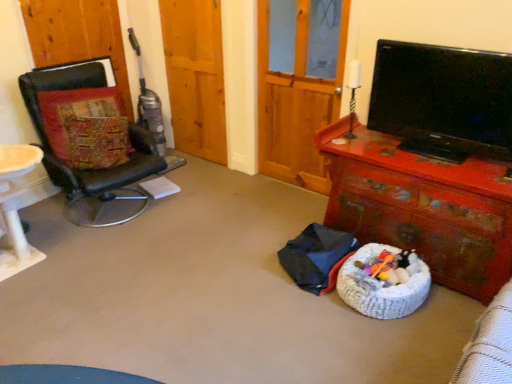
Image resolution: width=512 pixels, height=384 pixels. I want to click on free area in between black leather chair at left and dark blue fabric at center, so click(204, 238).